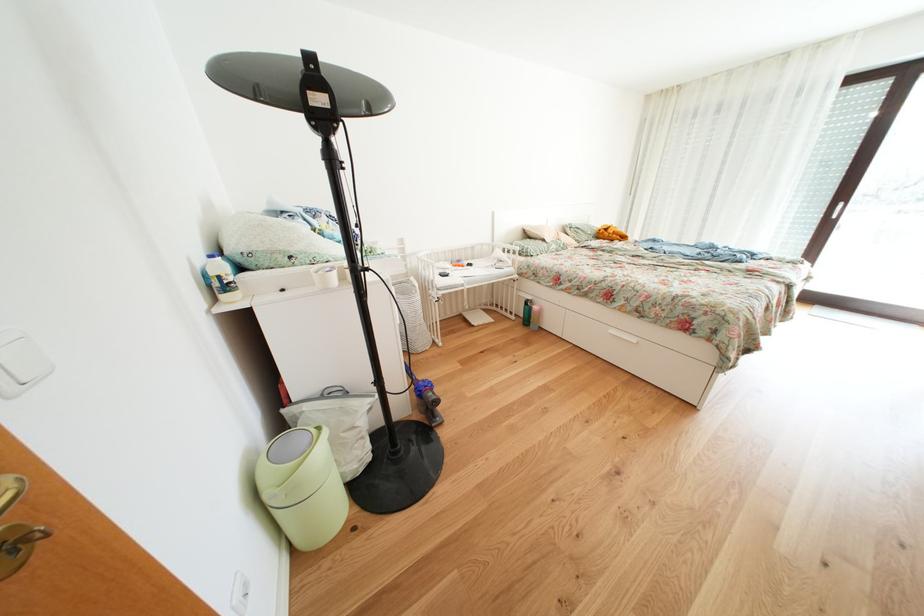
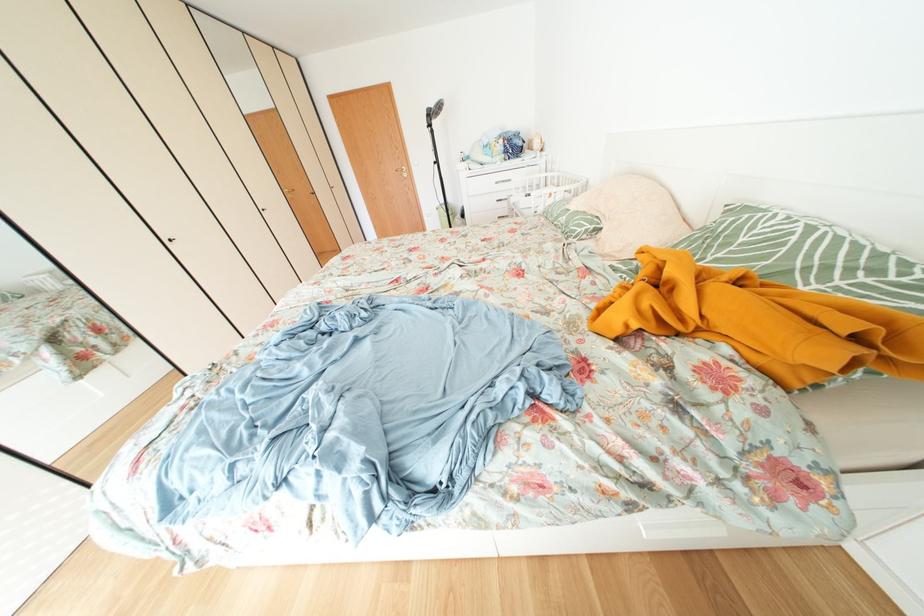
Question: I am providing you with two images of the same scene from different viewpoints. After the viewpoint changes to image2, which objects are now occluded?

Choices:
 (A) pink water bottle
 (B) white drawer handle
 (C) green patterned pillow
 (D) red ottoman sitting surface

Answer: (A)